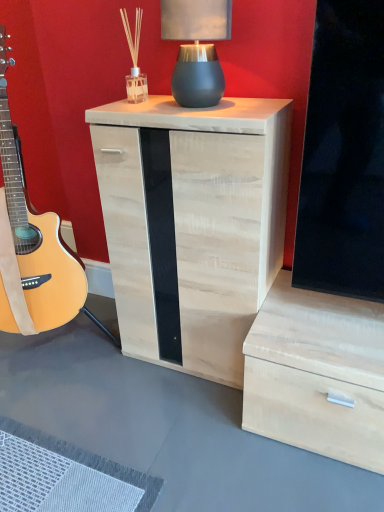
You are a GUI agent. You are given a task and a screenshot of the screen. Output one action in this format:
    pyautogui.click(x=<x>, y=<y>)
    Task: Click on the vacant region below matte gray ceramic table lamp at upper center (from a real-world perspective)
    
    Given the screenshot: What is the action you would take?
    pyautogui.click(x=211, y=101)